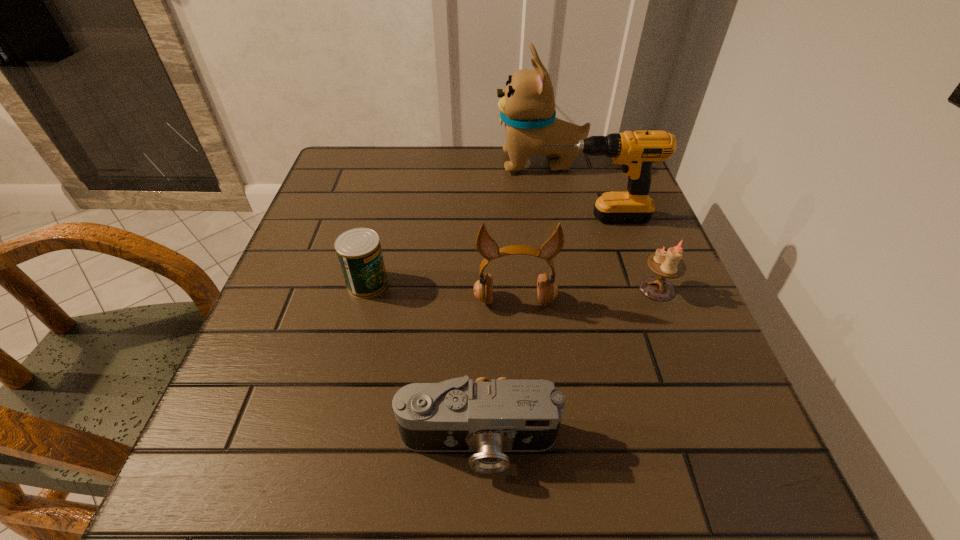
What are the coordinates of `drill that is at the right edge` in the screenshot? It's located at (636, 152).

In order to click on candle holder that is positioned at the right edge in this screenshot , I will do `click(666, 264)`.

Where is `object that is at the far right corner`? object that is at the far right corner is located at coordinates (527, 106).

Find the location of a particular element. This screenshot has width=960, height=540. vacant space at the far edge of the desktop is located at coordinates (444, 152).

Where is `vacant space at the near edge of the desktop`? This screenshot has width=960, height=540. vacant space at the near edge of the desktop is located at coordinates (422, 469).

Locate an element on the screen. free space at the left edge of the desktop is located at coordinates (373, 199).

In the image, there is a desktop. Where is `vacant space at the right edge`? The height and width of the screenshot is (540, 960). vacant space at the right edge is located at coordinates (683, 361).

In the image, there is a desktop. Where is `vacant space at the far left corner`? This screenshot has height=540, width=960. vacant space at the far left corner is located at coordinates coord(329,165).

Locate an element on the screen. vacant space that's between the candle holder and the leftmost object is located at coordinates (513, 286).

Image resolution: width=960 pixels, height=540 pixels. I want to click on vacant area that lies between the second farthest object and the third shortest object, so (625, 253).